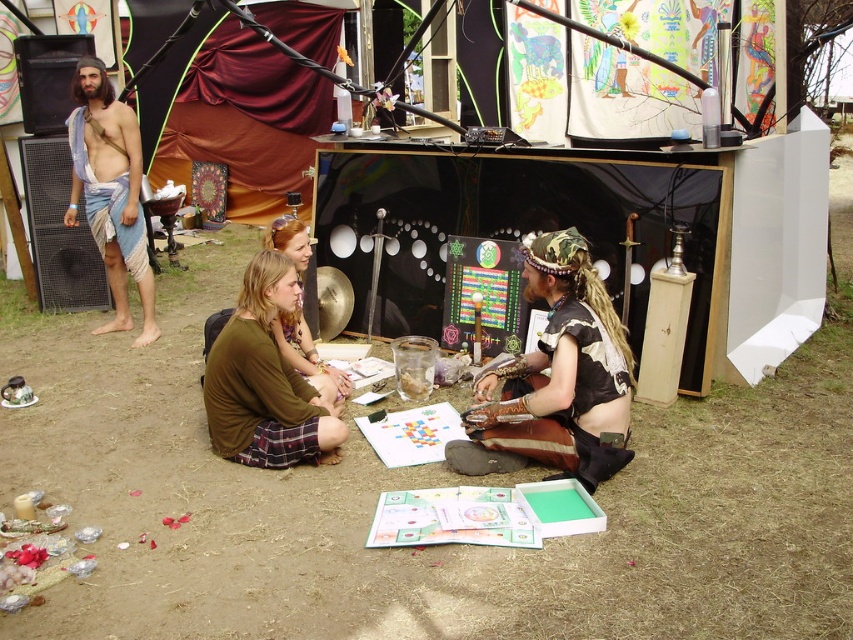
Who is higher up, blue fabric cloth at left or brown fabric shirt at center?

Positioned higher is blue fabric cloth at left.

Can you confirm if blue fabric cloth at left is positioned below brown fabric shirt at center?

No.

The width and height of the screenshot is (853, 640). I want to click on blue fabric cloth at left, so click(x=109, y=192).

Identify the location of brown plaid skirt at center. (265, 381).

Does point (247, 300) come closer to viewer compared to point (306, 372)?

Yes, point (247, 300) is closer to viewer.

Does point (263, 452) lie in front of point (288, 230)?

Yes.

Find the location of a particular element. The width and height of the screenshot is (853, 640). brown plaid skirt at center is located at coordinates (265, 381).

Can you confirm if brown plaid skirt at center is positioned to the right of blue fabric cloth at left?

Indeed, brown plaid skirt at center is positioned on the right side of blue fabric cloth at left.

At what (x,y) coordinates should I click in order to perform the action: click on brown plaid skirt at center. Please return your answer as a coordinate pair (x, y). The height and width of the screenshot is (640, 853). Looking at the image, I should click on (265, 381).

Find the location of `brown plaid skirt at center`. brown plaid skirt at center is located at coordinates (265, 381).